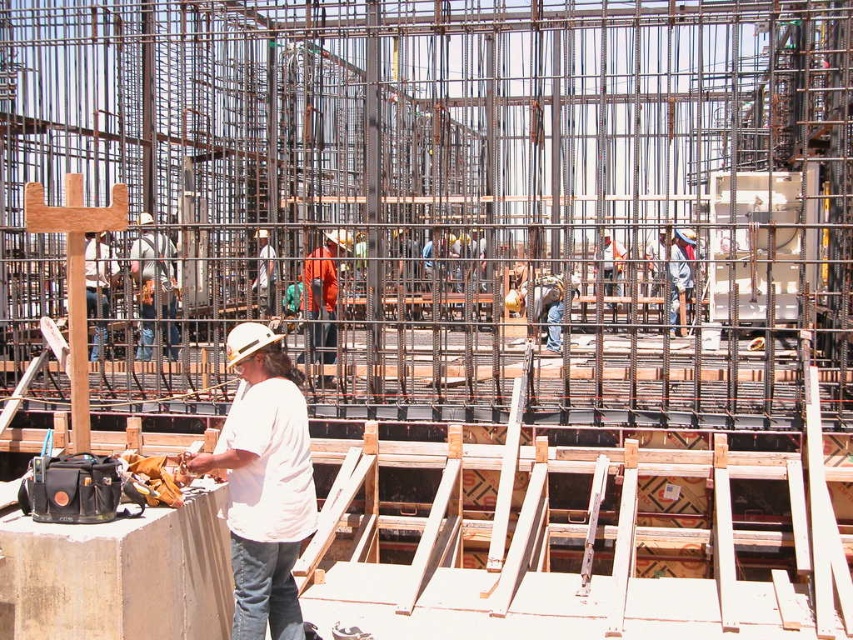
Between orange safety vest at center and orange fabric safety vest at center, which one is positioned higher?

orange safety vest at center is above.

From the picture: Can you confirm if orange safety vest at center is positioned below orange fabric safety vest at center?

No.

The height and width of the screenshot is (640, 853). I want to click on orange safety vest at center, so click(154, 285).

Locate an element on the screen. orange safety vest at center is located at coordinates (154, 285).

Is white matte shirt at center positioned behind white hard hat at center?

Yes.

Between white matte shirt at center and white hard hat at center, which one appears on the left side from the viewer's perspective?

From the viewer's perspective, white hard hat at center appears more on the left side.

Is point (247, 490) positioned in front of point (107, 246)?

Yes.

Identify the location of white matte shirt at center. The width and height of the screenshot is (853, 640). [x=263, y=483].

Who is positioned more to the left, orange safety vest at center or white hard hat at center?

Positioned to the left is white hard hat at center.

Which of these two, orange safety vest at center or white hard hat at center, stands shorter?

white hard hat at center is shorter.

Which is in front, point (155, 240) or point (113, 260)?

Point (155, 240)

Find the location of a particular element. The height and width of the screenshot is (640, 853). orange safety vest at center is located at coordinates (154, 285).